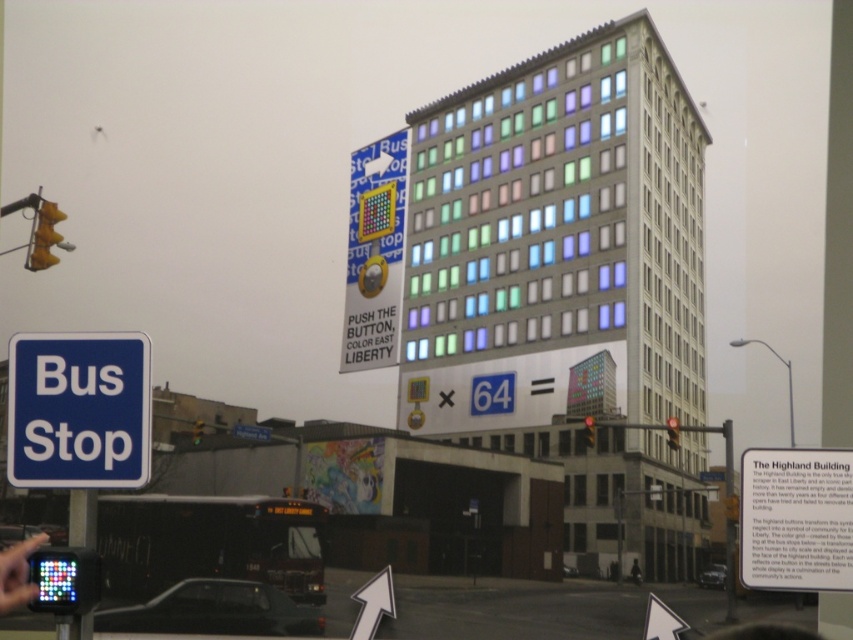
You are a city planner evaluating the placement of the blue plastic bus stop at lower left and the metallic pole at lower left. Considering their sizes, which one might be more suitable for installing a new advertisement board that requires a larger support structure?

The metallic pole at lower left is more suitable for installing the new advertisement board because it has a larger size compared to the blue plastic bus stop at lower left, providing better support.